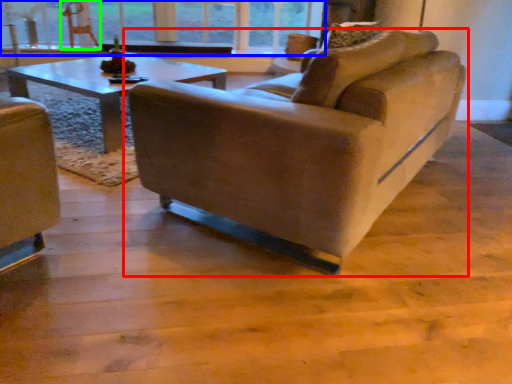
Question: Estimate the real-world distances between objects in this image. Which object is closer to studio couch (highlighted by a red box), window (highlighted by a blue box) or swivel chair (highlighted by a green box)?

Choices:
 (A) window
 (B) swivel chair

Answer: (A)